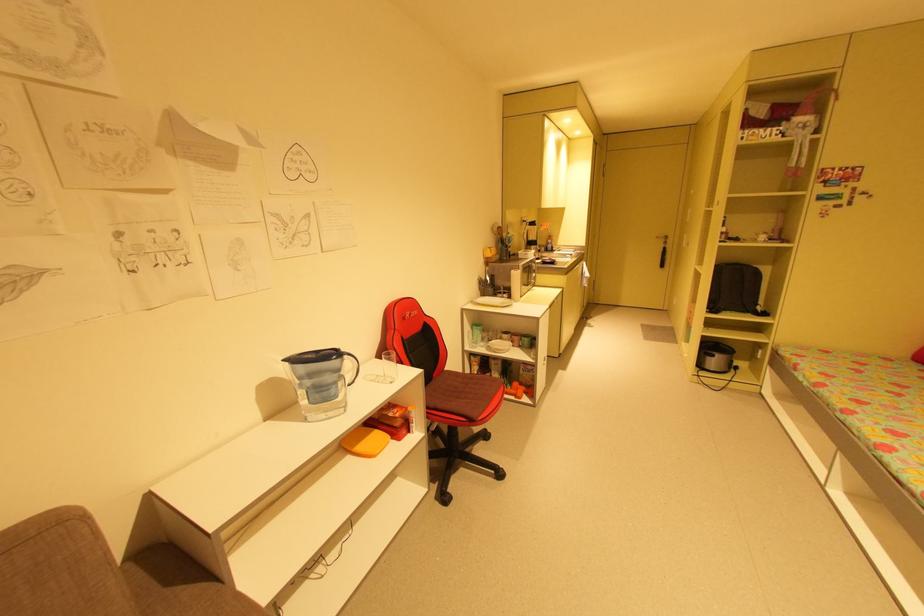
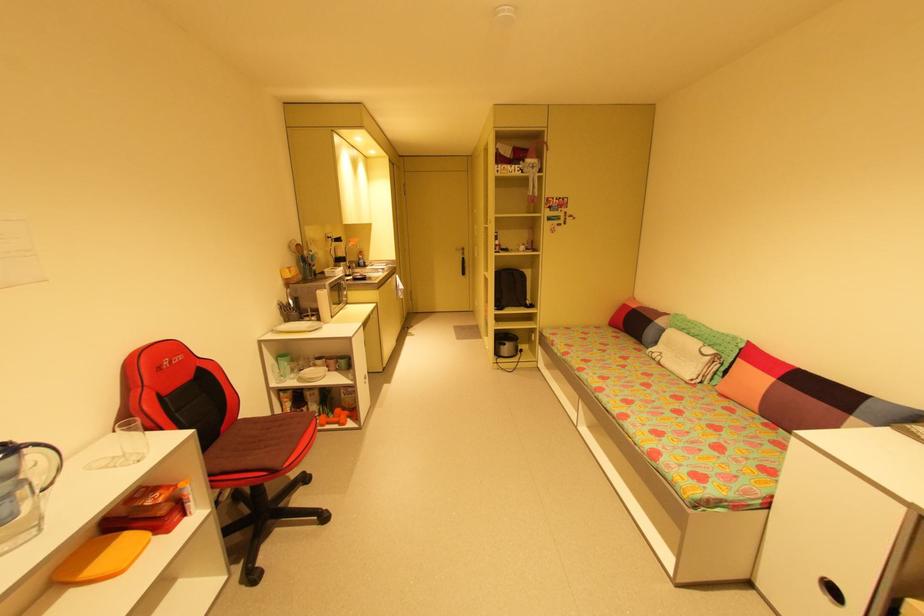
The point at [521,395] is marked in the first image. Where is the corresponding point in the second image?

(345, 422)